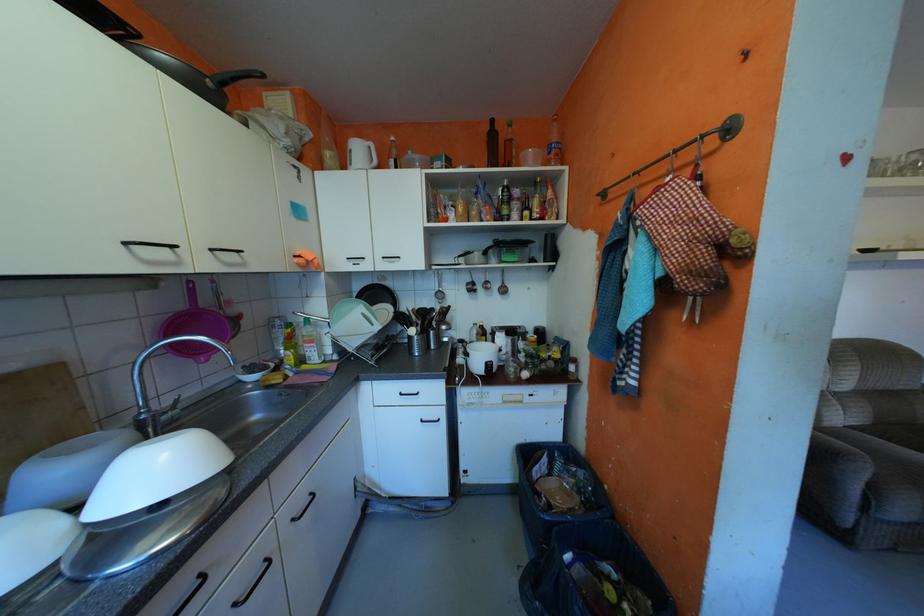
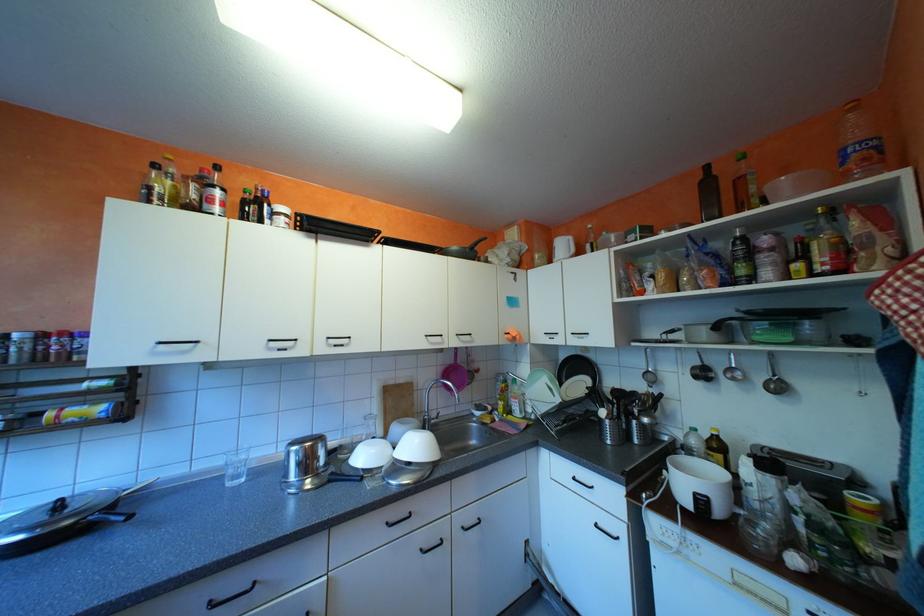
In the second image, find the point that corresponds to (x=479, y=283) in the first image.

(706, 367)